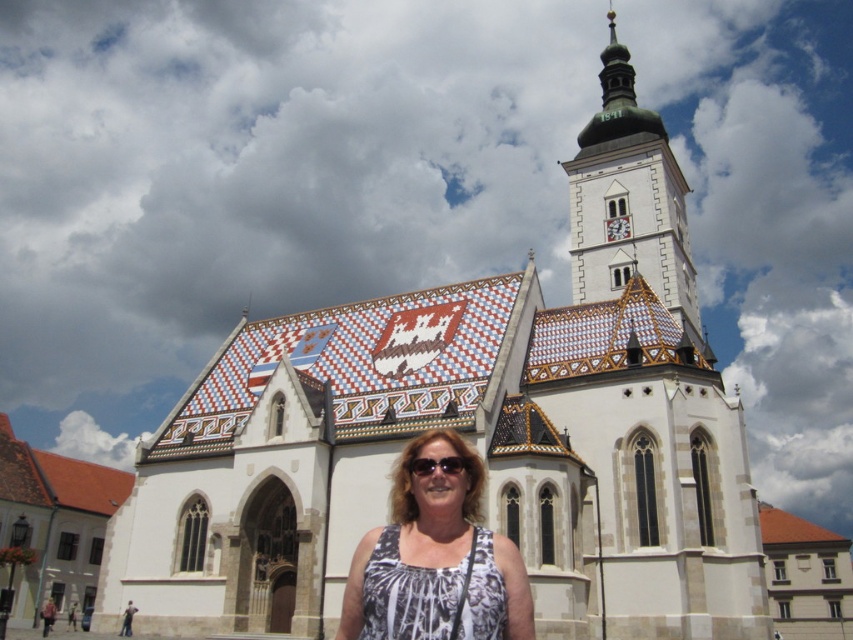
Question: Considering the real-world distances, which object is farthest from the green metallic tower at upper center?

Choices:
 (A) sunglasses at center
 (B) white printed tank top at center

Answer: (A)

Question: Can you confirm if white printed tank top at center is positioned above green metallic tower at upper center?

Choices:
 (A) yes
 (B) no

Answer: (B)

Question: Which of the following is the closest to the observer?

Choices:
 (A) sunglasses at center
 (B) white printed tank top at center
 (C) green metallic tower at upper center

Answer: (B)

Question: Where is white printed tank top at center located in relation to green metallic tower at upper center in the image?

Choices:
 (A) left
 (B) right

Answer: (A)

Question: Is green metallic tower at upper center above sunglasses at center?

Choices:
 (A) no
 (B) yes

Answer: (B)

Question: Which point is farther from the camera taking this photo?

Choices:
 (A) (419, 524)
 (B) (447, 472)

Answer: (A)